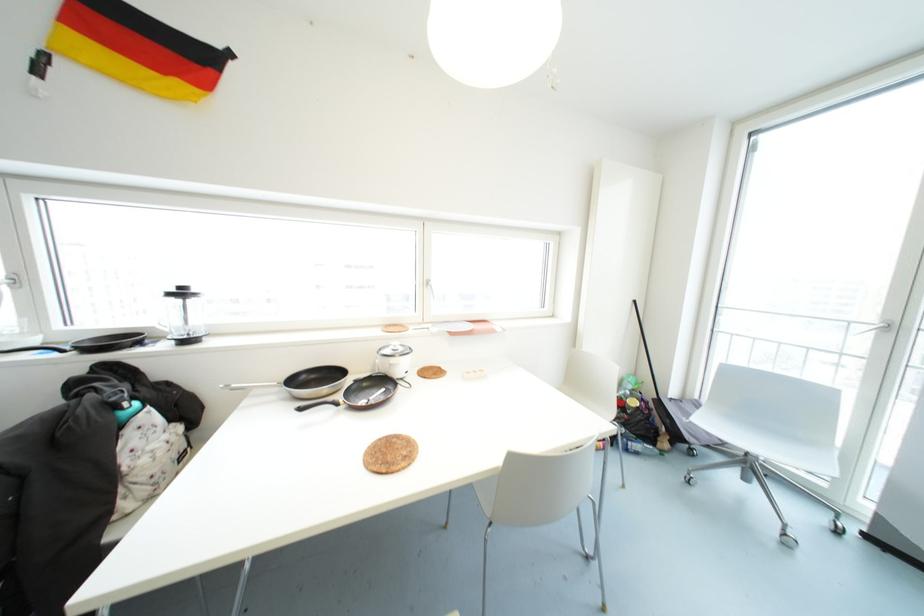
The image size is (924, 616). What do you see at coordinates (9, 281) in the screenshot?
I see `the silver door handle` at bounding box center [9, 281].